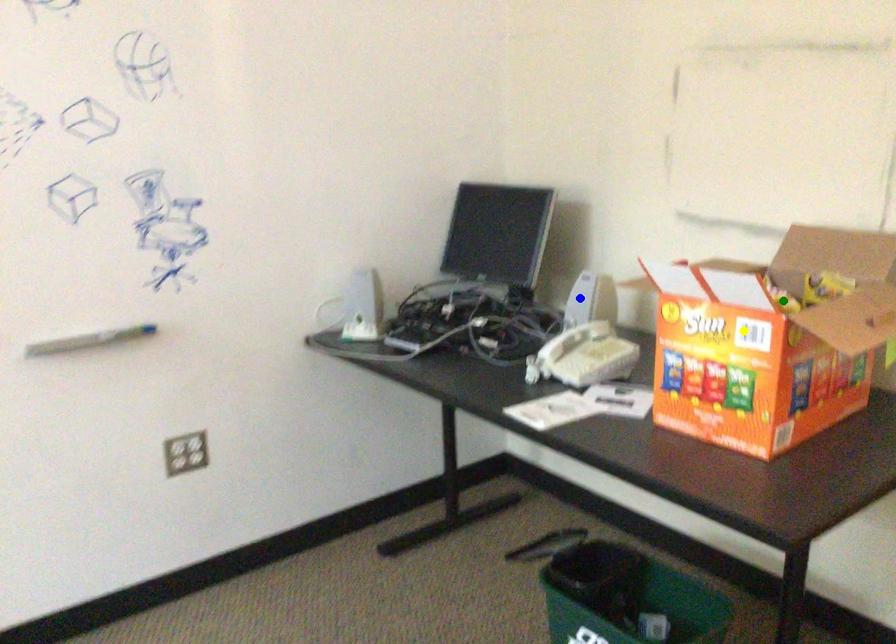
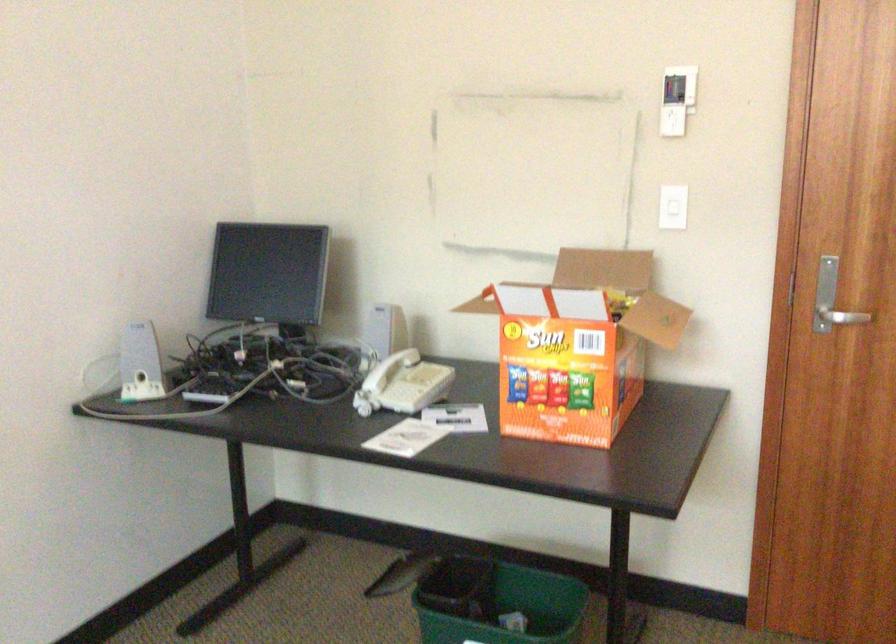
I am providing you with two images of the same scene from different viewpoints. Three points are marked in image1. Which point corresponds to a part or object that is occluded in image2?In image1, three points are marked. Which of them correspond to a part or object that is occluded in image2?Among the three points shown in image1, which one corresponds to a part or object that is no longer visible due to occlusion in image2?

green point